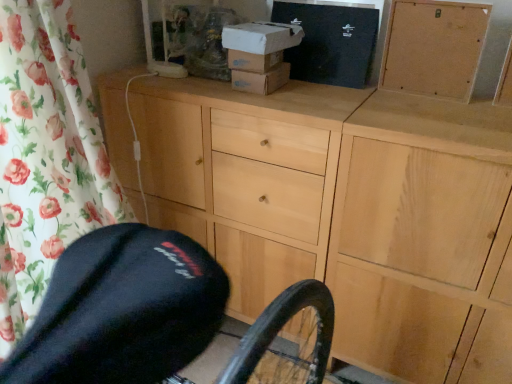
Question: From the image's perspective, is light wood cabinet at center beneath white cardboard box at upper center, the second box when ordered from right to left?

Choices:
 (A) no
 (B) yes

Answer: (B)

Question: From a real-world perspective, is light wood cabinet at center located beneath white cardboard box at upper center, the second box when ordered from right to left?

Choices:
 (A) yes
 (B) no

Answer: (A)

Question: Is white cardboard box at upper center, marked as the 1th box in a left-to-right arrangement, inside light wood cabinet at center?

Choices:
 (A) no
 (B) yes

Answer: (A)

Question: From the image's perspective, is light wood cabinet at center over white cardboard box at upper center, marked as the 1th box in a left-to-right arrangement?

Choices:
 (A) yes
 (B) no

Answer: (B)

Question: Does light wood cabinet at center have a greater height compared to white cardboard box at upper center, the second box when ordered from right to left?

Choices:
 (A) yes
 (B) no

Answer: (A)

Question: Does light wood cabinet at center have a lesser width compared to white cardboard box at upper center, the second box when ordered from right to left?

Choices:
 (A) yes
 (B) no

Answer: (B)

Question: Can you confirm if black cardboard box at upper center, marked as the 1th box in a right-to-left arrangement, is positioned to the left of corkboard at upper right?

Choices:
 (A) no
 (B) yes

Answer: (B)

Question: Is black cardboard box at upper center, which ranks as the second box in left-to-right order, wider than corkboard at upper right?

Choices:
 (A) no
 (B) yes

Answer: (B)

Question: Is the position of black cardboard box at upper center, which ranks as the second box in left-to-right order, less distant than that of corkboard at upper right?

Choices:
 (A) yes
 (B) no

Answer: (B)

Question: From the image's perspective, is black cardboard box at upper center, which ranks as the second box in left-to-right order, located above corkboard at upper right?

Choices:
 (A) yes
 (B) no

Answer: (A)

Question: Is black cardboard box at upper center, which ranks as the second box in left-to-right order, smaller than corkboard at upper right?

Choices:
 (A) no
 (B) yes

Answer: (A)

Question: Does black cardboard box at upper center, which ranks as the second box in left-to-right order, have a greater width compared to light wood cabinet at center?

Choices:
 (A) yes
 (B) no

Answer: (B)